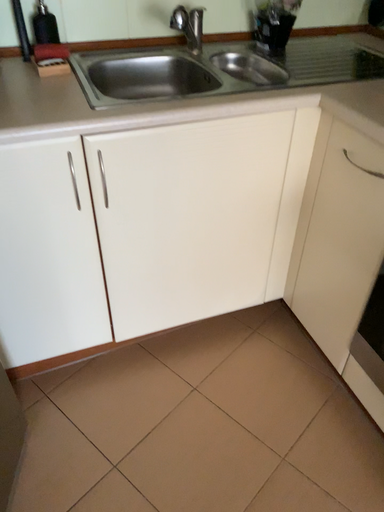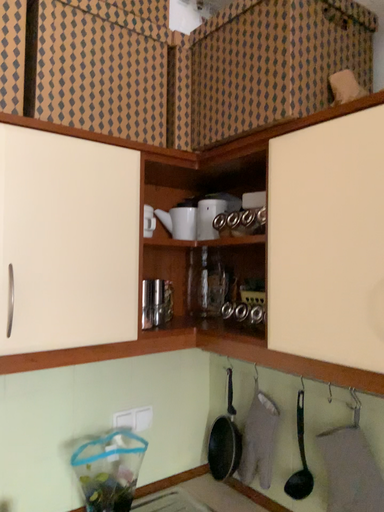
Question: How did the camera likely rotate when shooting the video?

Choices:
 (A) rotated downward
 (B) rotated upward

Answer: (B)